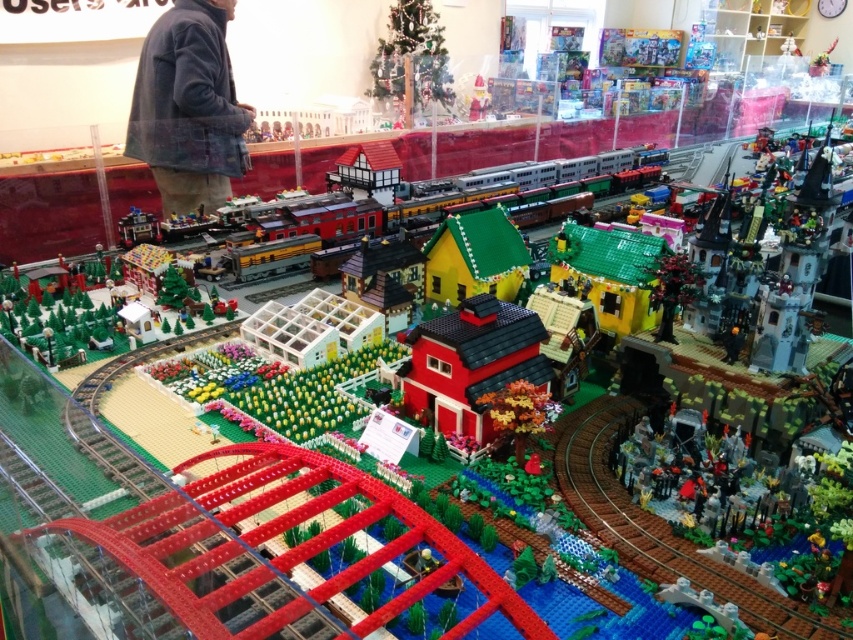
From the picture: You are a customer at the Lego store looking at the display. You see the brick train at center and the matte white santa at upper center. Which object is positioned higher in the image?

The matte white santa at upper center is positioned higher in the image than the brick train at center.

You are a Lego enthusiast observing the display. You notice the brick train at center and the matte white santa at upper center. Which object is wider?

The brick train at center is wider than the matte white santa at upper center because its width surpasses that of the santa.

You are a visitor looking at the Lego model set. You notice the brick red barn at center and the matte white santa at upper center. Which object is closer to you in the scene?

The brick red barn at center is closer to you because it is in front of the matte white santa at upper center.